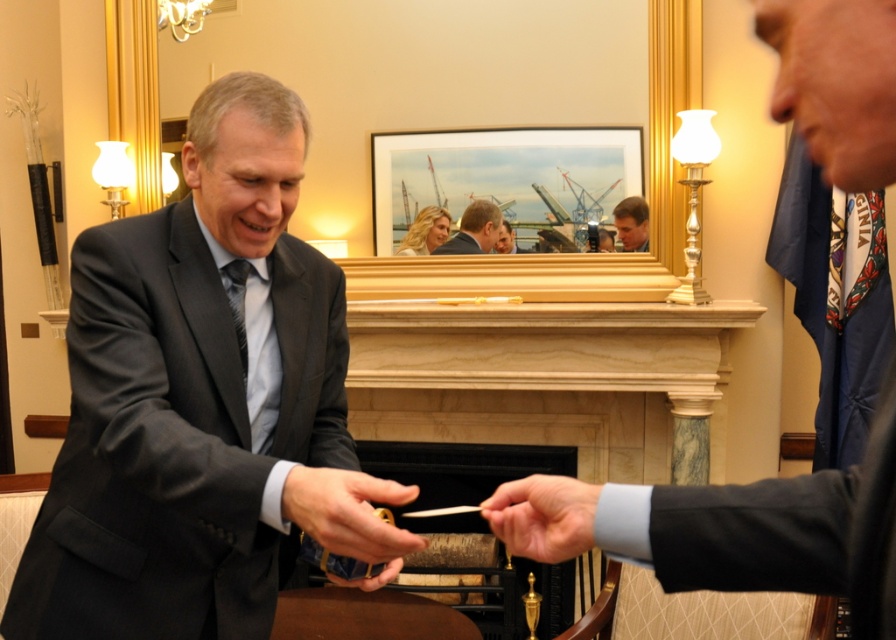
Question: Among these points, which one is nearest to the camera?

Choices:
 (A) (794, 90)
 (B) (398, 244)
 (C) (315, 516)
 (D) (467, 252)

Answer: (A)

Question: Which object appears farthest from the camera in this image?

Choices:
 (A) gray textured tie at left
 (B) smooth skin hand at center
 (C) gold-framed photograph at upper center
 (D) dark blue suit at right

Answer: (C)

Question: Is dark blue suit at right above smooth gray suit at center?

Choices:
 (A) yes
 (B) no

Answer: (B)

Question: Is gray textured tie at left to the right of matte black suit at center from the viewer's perspective?

Choices:
 (A) no
 (B) yes

Answer: (A)

Question: Which object is the farthest from the matte black suit at center?

Choices:
 (A) dark blue suit at right
 (B) gray textured tie at left
 (C) matte black hand at center
 (D) smooth skin hand at center

Answer: (A)

Question: Is smooth gray suit at center bigger than matte black suit at center?

Choices:
 (A) no
 (B) yes

Answer: (B)